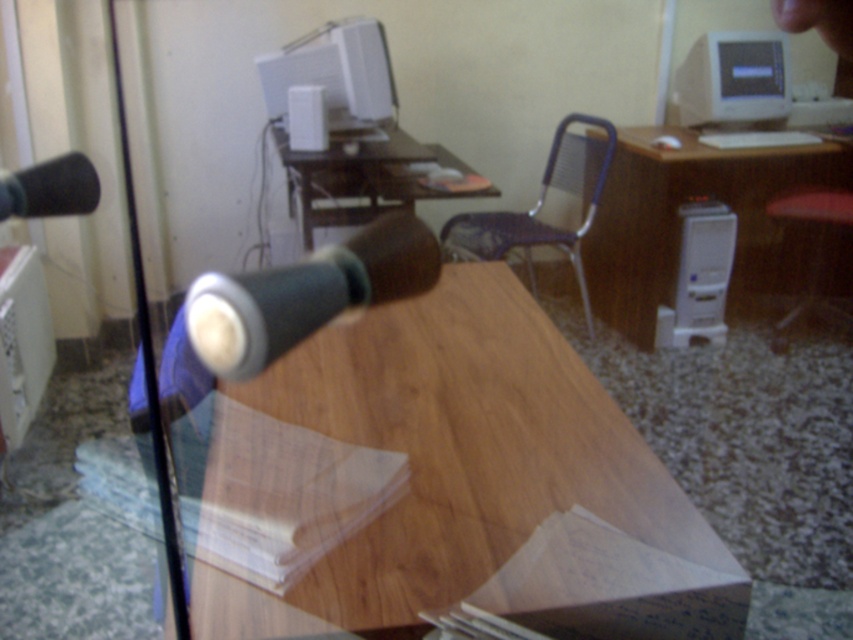
Question: Is white plastic computer tower at center right further to the viewer compared to matte black speaker at upper center?

Choices:
 (A) yes
 (B) no

Answer: (A)

Question: Among these objects, which one is farthest from the camera?

Choices:
 (A) matte plastic monitor at upper center
 (B) black rubber microphone at center
 (C) white plastic computer tower at center right

Answer: (C)

Question: Does white plastic computer tower at right appear over black matte microphone at left?

Choices:
 (A) yes
 (B) no

Answer: (B)

Question: Which is farther from the black matte microphone at left?

Choices:
 (A) white plastic computer tower at right
 (B) black rubber microphone at center
 (C) wooden at center

Answer: (A)

Question: Which of these objects is positioned closest to the black rubber microphone at center?

Choices:
 (A) white glossy monitor at upper right
 (B) red cushioned stool at right

Answer: (A)

Question: Can you confirm if white glossy monitor at upper right is positioned above white plastic computer tower at right?

Choices:
 (A) no
 (B) yes

Answer: (B)